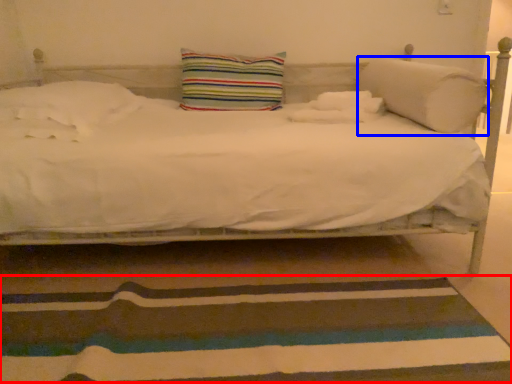
Question: Which point is further to the camera, doormat (highlighted by a red box) or pillow (highlighted by a blue box)?

Choices:
 (A) doormat
 (B) pillow

Answer: (B)